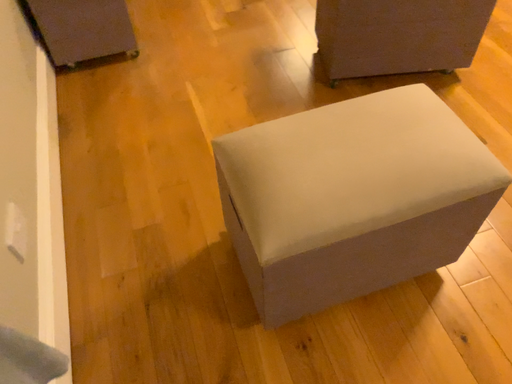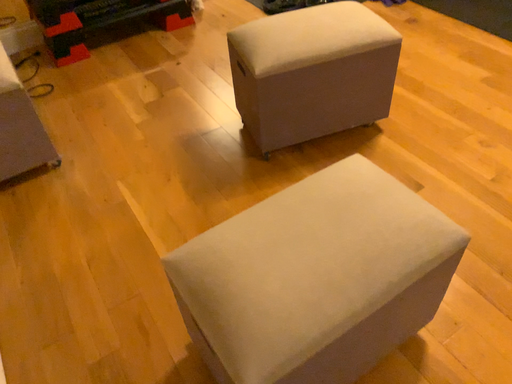
Question: Which way did the camera rotate in the video?

Choices:
 (A) rotated right
 (B) rotated left

Answer: (A)